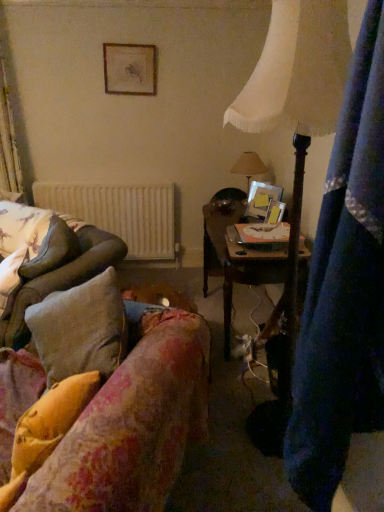
Question: From a real-world perspective, does wooden desk at center stand above white fabric lampshade at upper right?

Choices:
 (A) no
 (B) yes

Answer: (A)

Question: Are wooden desk at center and white fabric lampshade at upper right far apart?

Choices:
 (A) yes
 (B) no

Answer: (B)

Question: Can you confirm if wooden desk at center is bigger than white fabric lampshade at upper right?

Choices:
 (A) no
 (B) yes

Answer: (A)

Question: From a real-world perspective, is wooden desk at center beneath white fabric lampshade at upper right?

Choices:
 (A) no
 (B) yes

Answer: (B)

Question: Does wooden desk at center appear on the right side of white fabric lampshade at upper right?

Choices:
 (A) yes
 (B) no

Answer: (A)

Question: Is fluffy beige pillow at left, which is the first pillow from top to bottom, taller or shorter than fluffy fabric couch at lower left?

Choices:
 (A) short
 (B) tall

Answer: (A)

Question: From a real-world perspective, relative to fluffy fabric couch at lower left, is fluffy beige pillow at left, arranged as the first pillow when viewed from the back, vertically above or below?

Choices:
 (A) above
 (B) below

Answer: (A)

Question: Is fluffy beige pillow at left, the second pillow when ordered from front to back, inside or outside of fluffy fabric couch at lower left?

Choices:
 (A) outside
 (B) inside

Answer: (A)

Question: From the image's perspective, is fluffy beige pillow at left, which is the first pillow from top to bottom, located above or below fluffy fabric couch at lower left?

Choices:
 (A) below
 (B) above

Answer: (B)

Question: Considering the positions of fluffy yellow pillow at lower left, acting as the 1th pillow starting from the bottom, and fluffy beige pillow at left, which is counted as the second pillow, starting from the right, in the image, is fluffy yellow pillow at lower left, acting as the 1th pillow starting from the bottom, bigger or smaller than fluffy beige pillow at left, which is counted as the second pillow, starting from the right,?

Choices:
 (A) big
 (B) small

Answer: (B)

Question: Is fluffy yellow pillow at lower left, acting as the 1th pillow starting from the bottom, wider or thinner than fluffy beige pillow at left, which is counted as the second pillow, starting from the right?

Choices:
 (A) wide
 (B) thin

Answer: (A)

Question: From a real-world perspective, is fluffy yellow pillow at lower left, acting as the 1th pillow starting from the bottom, above or below fluffy beige pillow at left, the 2th pillow positioned from the bottom?

Choices:
 (A) below
 (B) above

Answer: (A)

Question: Is fluffy yellow pillow at lower left, which is the 2th pillow from back to front, in front of or behind fluffy beige pillow at left, the 2th pillow positioned from the bottom, in the image?

Choices:
 (A) behind
 (B) front

Answer: (B)

Question: Choose the correct answer: Is wooden picture frame at center, positioned as the third picture frame in top-to-bottom order, inside fluffy beige pillow at left, the second pillow when ordered from front to back, or outside it?

Choices:
 (A) outside
 (B) inside

Answer: (A)

Question: Considering the positions of wooden picture frame at center, which is the 1th picture frame from front to back, and fluffy beige pillow at left, the 2th pillow positioned from the bottom, in the image, is wooden picture frame at center, which is the 1th picture frame from front to back, taller or shorter than fluffy beige pillow at left, the 2th pillow positioned from the bottom,?

Choices:
 (A) short
 (B) tall

Answer: (A)